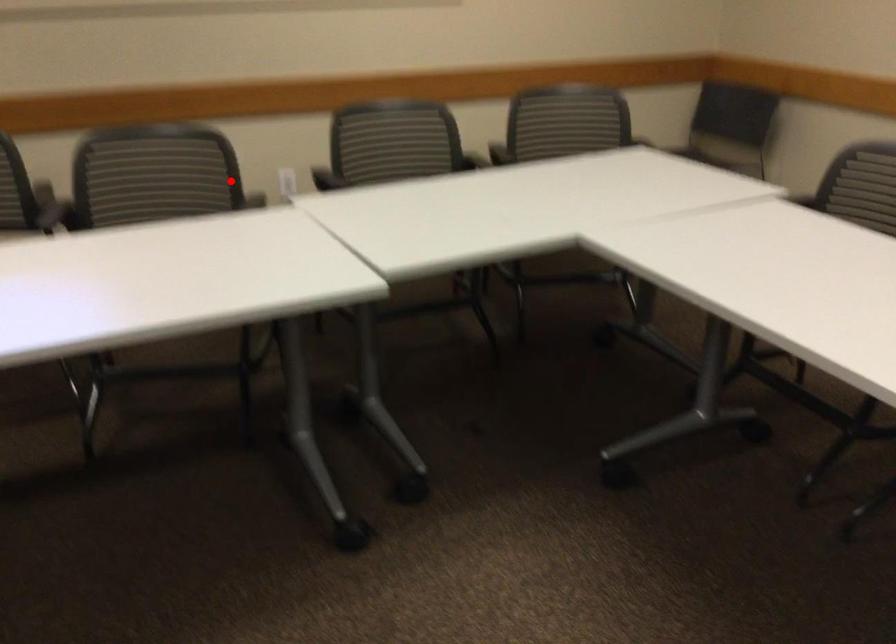
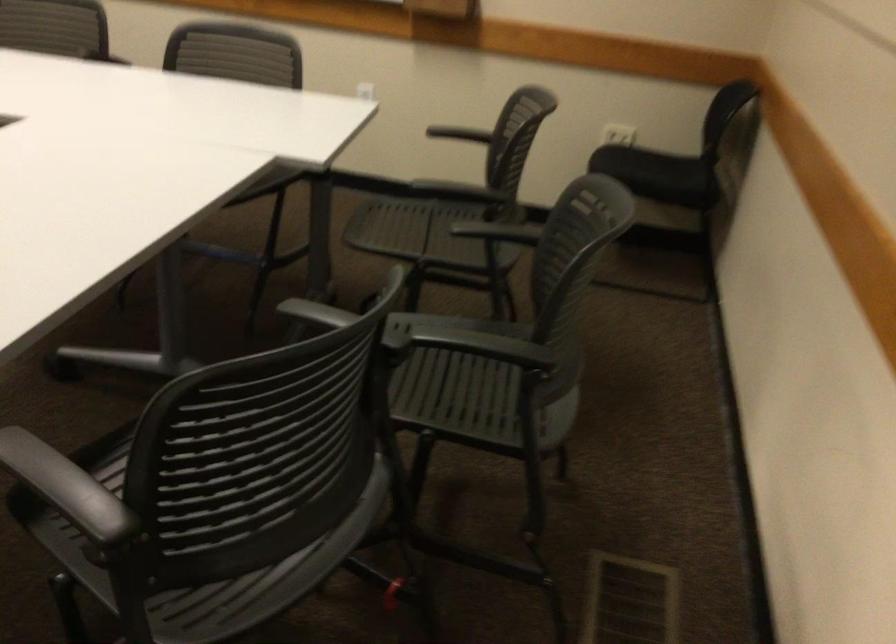
Question: I am providing you with two images of the same scene from different viewpoints. Given a red point in image1, look at the same physical point in image2. Is it:

Choices:
 (A) Closer to the viewpoint
 (B) Farther from the viewpoint

Answer: (A)